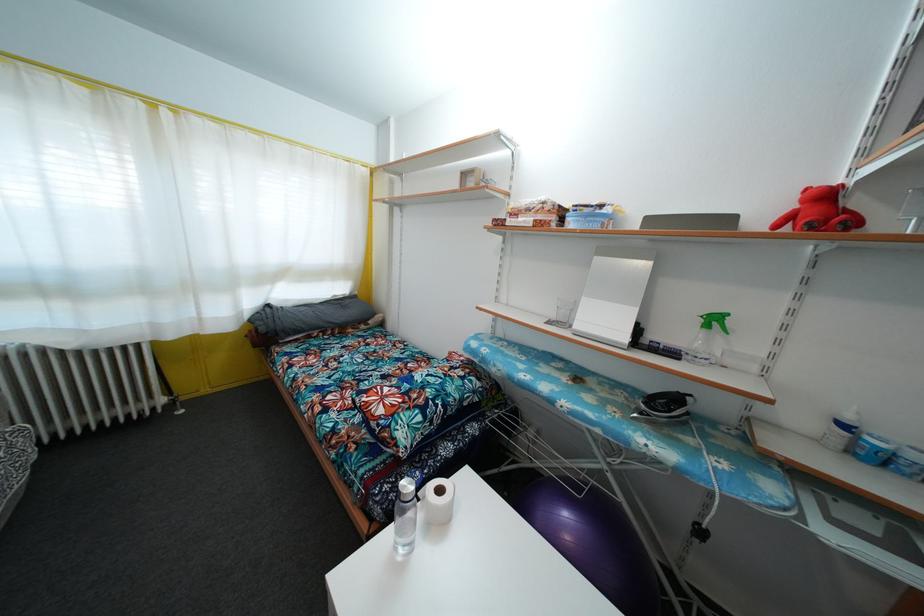
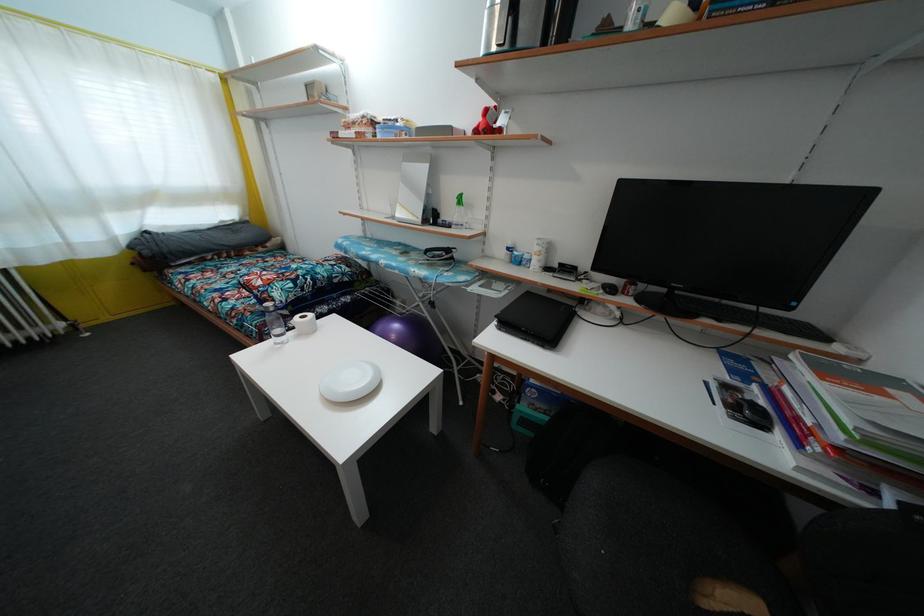
Find the pixel in the second image that matches (377,431) in the first image.

(259, 299)